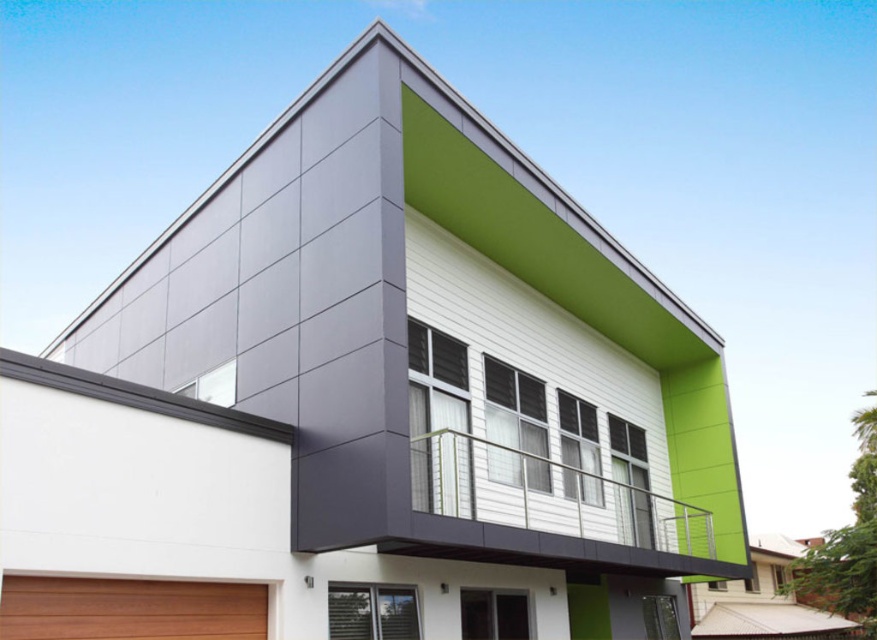
Can you confirm if metallic silver balcony at upper center is positioned above brown wood at lower left?

No.

The height and width of the screenshot is (640, 877). Identify the location of metallic silver balcony at upper center. (548, 496).

Find the location of a particular element. metallic silver balcony at upper center is located at coordinates (548, 496).